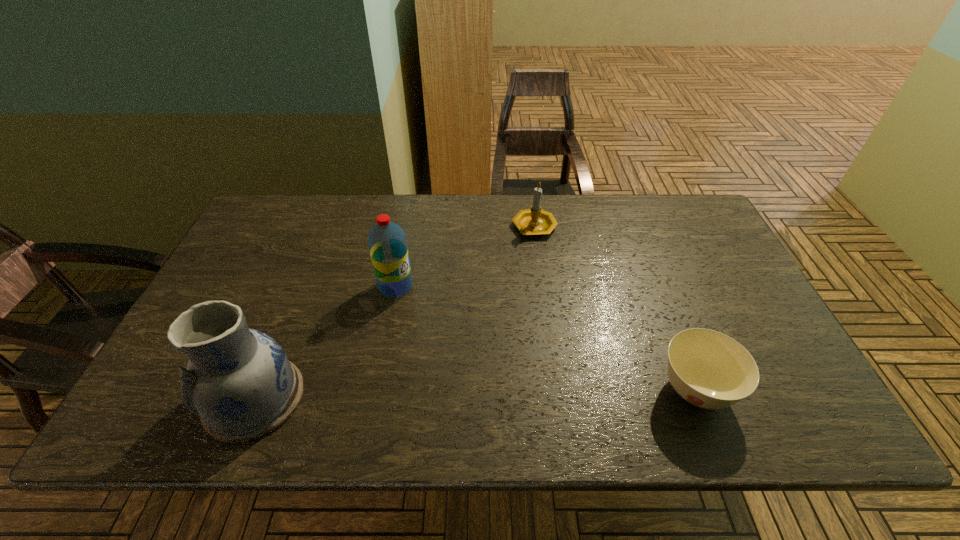
I want to click on free spot between the water bottle and the second shortest object, so click(x=465, y=257).

This screenshot has width=960, height=540. What are the coordinates of `vacant region between the second farthest object and the leftmost object` in the screenshot? It's located at (325, 342).

You are a GUI agent. You are given a task and a screenshot of the screen. Output one action in this format:
    pyautogui.click(x=<x>, y=<y>)
    Task: Click on the empty space that is in between the third tallest object and the second object from left to right
    
    Given the screenshot: What is the action you would take?
    pyautogui.click(x=465, y=257)

Identify the location of unoccupied area between the water bottle and the shortest object. The image size is (960, 540). (545, 338).

Find the location of a particular element. The width and height of the screenshot is (960, 540). free space between the pottery and the candle holder is located at coordinates (395, 313).

Locate an element on the screen. empty space that is in between the rightmost object and the leftmost object is located at coordinates (475, 394).

Locate an element on the screen. vacant area that lies between the rightmost object and the leftmost object is located at coordinates (475, 394).

Point out which object is positioned as the nearest to the rightmost object. Please provide its 2D coordinates. Your answer should be formatted as a tuple, i.e. [(x, y)], where the tuple contains the x and y coordinates of a point satisfying the conditions above.

[(534, 221)]

Identify which object is the third nearest to the second object from right to left. Please provide its 2D coordinates. Your answer should be formatted as a tuple, i.e. [(x, y)], where the tuple contains the x and y coordinates of a point satisfying the conditions above.

[(240, 382)]

The height and width of the screenshot is (540, 960). In order to click on free space in the image that satisfies the following two spatial constraints: 1. on the front side of the farthest object; 2. on the left side of the rightmost object in this screenshot , I will do `click(557, 390)`.